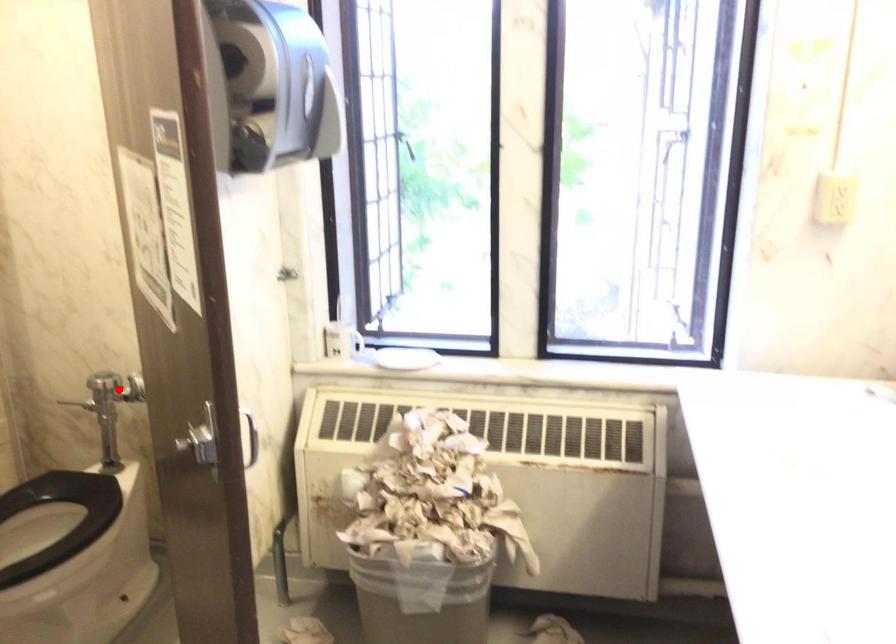
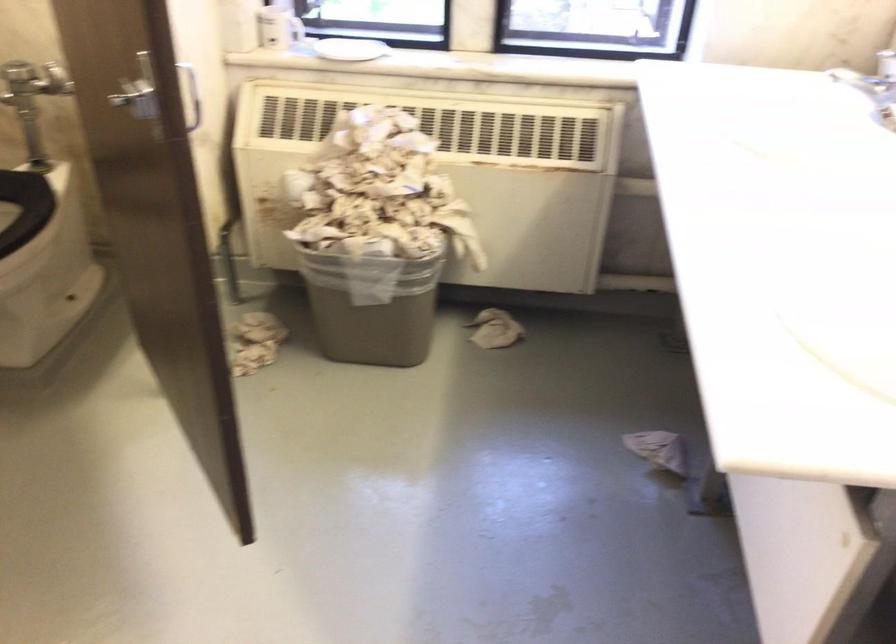
Locate, in the second image, the point that corresponds to the highlighted location in the first image.

(32, 80)